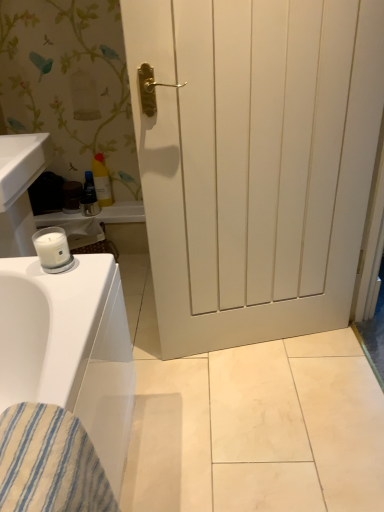
Image resolution: width=384 pixels, height=512 pixels. What do you see at coordinates (49, 463) in the screenshot? I see `blue striped fabric at lower left` at bounding box center [49, 463].

Where is `yellow plastic bottle at upper left, the first toiletry from the right`? Image resolution: width=384 pixels, height=512 pixels. yellow plastic bottle at upper left, the first toiletry from the right is located at coordinates (102, 181).

The image size is (384, 512). Identify the location of blue striped fabric at lower left. 49,463.

From a real-world perspective, is white matte door at center on top of blue striped fabric at lower left?

Correct, in the physical world, white matte door at center is higher than blue striped fabric at lower left.

Is point (345, 234) positioned in front of point (80, 498)?

No, (345, 234) is further to viewer.

Based on the photo, from the image's perspective, which is below, white matte door at center or blue striped fabric at lower left?

blue striped fabric at lower left.

Is white matte door at center situated inside blue striped fabric at lower left or outside?

white matte door at center is spatially situated outside blue striped fabric at lower left.

Consider the image. From the image's perspective, which one is positioned lower, blue glossy tube at center, the second toiletry when ordered from right to left, or white matte door at center?

white matte door at center appears lower in the image.

Can we say blue glossy tube at center, the second toiletry when ordered from right to left, lies outside white matte door at center?

blue glossy tube at center, the second toiletry when ordered from right to left, lies outside white matte door at center's area.

Based on the photo, does blue glossy tube at center, the second toiletry when ordered from right to left, appear on the left side of white matte door at center?

Indeed, blue glossy tube at center, the second toiletry when ordered from right to left, is positioned on the left side of white matte door at center.

Between blue glossy tube at center, the second toiletry when ordered from right to left, and white matte door at center, which one has smaller size?

blue glossy tube at center, the second toiletry when ordered from right to left.

Would you consider white matte door at center to be distant from yellow plastic bottle at upper left, the second toiletry in the left-to-right sequence?

Yes, white matte door at center and yellow plastic bottle at upper left, the second toiletry in the left-to-right sequence, are located far from each other.

Is yellow plastic bottle at upper left, the first toiletry from the right, a part of white matte door at center?

No, yellow plastic bottle at upper left, the first toiletry from the right, is not surrounded by white matte door at center.

Which is less distant, (324, 232) or (98, 195)?

Point (324, 232)

From the image's perspective, is white matte door at center located above yellow plastic bottle at upper left, the first toiletry from the right?

Actually, white matte door at center appears below yellow plastic bottle at upper left, the first toiletry from the right, in the image.

Which of these two, yellow plastic bottle at upper left, the first toiletry from the right, or white matte door at center, is wider?

Wider between the two is white matte door at center.

Is yellow plastic bottle at upper left, the second toiletry in the left-to-right sequence, facing away from white matte door at center?

No, yellow plastic bottle at upper left, the second toiletry in the left-to-right sequence,'s orientation is not away from white matte door at center.

From a real-world perspective, is yellow plastic bottle at upper left, the second toiletry in the left-to-right sequence, located higher than white matte door at center?

No, from a real-world perspective, yellow plastic bottle at upper left, the second toiletry in the left-to-right sequence, is not over white matte door at center

Looking at their sizes, would you say blue glossy tube at center, which is the first toiletry in left-to-right order, is wider or thinner than yellow plastic bottle at upper left, the second toiletry in the left-to-right sequence?

blue glossy tube at center, which is the first toiletry in left-to-right order, is thinner than yellow plastic bottle at upper left, the second toiletry in the left-to-right sequence.

Looking at this image, considering the relative positions of blue glossy tube at center, which is the first toiletry in left-to-right order, and yellow plastic bottle at upper left, the second toiletry in the left-to-right sequence, in the image provided, is blue glossy tube at center, which is the first toiletry in left-to-right order, behind yellow plastic bottle at upper left, the second toiletry in the left-to-right sequence,?

Yes, blue glossy tube at center, which is the first toiletry in left-to-right order, is further from the camera.

Consider the image. Between blue glossy tube at center, the second toiletry when ordered from right to left, and yellow plastic bottle at upper left, the second toiletry in the left-to-right sequence, which one has smaller size?

blue glossy tube at center, the second toiletry when ordered from right to left.

Considering the positions of objects blue glossy tube at center, which is the first toiletry in left-to-right order, and yellow plastic bottle at upper left, the second toiletry in the left-to-right sequence, in the image provided, who is more to the left, blue glossy tube at center, which is the first toiletry in left-to-right order, or yellow plastic bottle at upper left, the second toiletry in the left-to-right sequence,?

blue glossy tube at center, which is the first toiletry in left-to-right order.

From a real-world perspective, is blue striped fabric at lower left above or below white matte door at center?

From a real-world perspective, blue striped fabric at lower left is physically below white matte door at center.

Is blue striped fabric at lower left not near white matte door at center?

That's not correct — blue striped fabric at lower left is a little close to white matte door at center.

Locate an element on the screen. The image size is (384, 512). door located on the right of blue striped fabric at lower left is located at coordinates (255, 162).

Is blue striped fabric at lower left spatially inside white matte door at center, or outside of it?

blue striped fabric at lower left lies outside white matte door at center.

This screenshot has width=384, height=512. In order to click on toiletry that appears behind the yellow plastic bottle at upper left, the second toiletry in the left-to-right sequence in this screenshot , I will do `click(89, 197)`.

Is yellow plastic bottle at upper left, the first toiletry from the right, inside or outside of blue glossy tube at center, which is the first toiletry in left-to-right order?

yellow plastic bottle at upper left, the first toiletry from the right, is spatially situated outside blue glossy tube at center, which is the first toiletry in left-to-right order.

Is yellow plastic bottle at upper left, the first toiletry from the right, not near blue glossy tube at center, which is the first toiletry in left-to-right order?

No, yellow plastic bottle at upper left, the first toiletry from the right, is not far away from blue glossy tube at center, which is the first toiletry in left-to-right order.

At what (x,y) coordinates should I click in order to perform the action: click on material in front of the white matte door at center. Please return your answer as a coordinate pair (x, y). Image resolution: width=384 pixels, height=512 pixels. Looking at the image, I should click on (49, 463).

The image size is (384, 512). I want to click on door on the right of the blue glossy tube at center, which is the first toiletry in left-to-right order, so click(x=255, y=162).

Estimate the real-world distances between objects in this image. Which object is closer to white matte door at center, blue striped fabric at lower left or blue glossy tube at center, the second toiletry when ordered from right to left?

blue striped fabric at lower left is closer to white matte door at center.

When comparing their distances from blue striped fabric at lower left, does blue glossy tube at center, the second toiletry when ordered from right to left, or white matte door at center seem closer?

white matte door at center lies closer to blue striped fabric at lower left than the other object.

Considering their positions, is blue glossy tube at center, which is the first toiletry in left-to-right order, positioned closer to yellow plastic bottle at upper left, the first toiletry from the right, than white matte door at center?

The object closer to yellow plastic bottle at upper left, the first toiletry from the right, is blue glossy tube at center, which is the first toiletry in left-to-right order.

Estimate the real-world distances between objects in this image. Which object is closer to yellow plastic bottle at upper left, the first toiletry from the right, white matte door at center or blue glossy tube at center, which is the first toiletry in left-to-right order?

blue glossy tube at center, which is the first toiletry in left-to-right order, is positioned closer to the anchor yellow plastic bottle at upper left, the first toiletry from the right.

Estimate the real-world distances between objects in this image. Which object is further from white matte door at center, blue striped fabric at lower left or yellow plastic bottle at upper left, the first toiletry from the right?

Among the two, yellow plastic bottle at upper left, the first toiletry from the right, is located further to white matte door at center.

Considering their positions, is yellow plastic bottle at upper left, the second toiletry in the left-to-right sequence, positioned closer to blue glossy tube at center, the second toiletry when ordered from right to left, than white matte door at center?

yellow plastic bottle at upper left, the second toiletry in the left-to-right sequence, lies closer to blue glossy tube at center, the second toiletry when ordered from right to left, than the other object.

Considering their positions, is blue striped fabric at lower left positioned further to blue glossy tube at center, the second toiletry when ordered from right to left, than yellow plastic bottle at upper left, the first toiletry from the right?

Based on the image, blue striped fabric at lower left appears to be further to blue glossy tube at center, the second toiletry when ordered from right to left.

Estimate the real-world distances between objects in this image. Which object is closer to yellow plastic bottle at upper left, the first toiletry from the right, blue striped fabric at lower left or white matte door at center?

white matte door at center lies closer to yellow plastic bottle at upper left, the first toiletry from the right, than the other object.

Where is `toiletry located between white matte door at center and blue glossy tube at center, which is the first toiletry in left-to-right order, in the depth direction`? This screenshot has width=384, height=512. toiletry located between white matte door at center and blue glossy tube at center, which is the first toiletry in left-to-right order, in the depth direction is located at coordinates (102, 181).

Where is `toiletry positioned between blue striped fabric at lower left and blue glossy tube at center, the second toiletry when ordered from right to left, from near to far`? This screenshot has width=384, height=512. toiletry positioned between blue striped fabric at lower left and blue glossy tube at center, the second toiletry when ordered from right to left, from near to far is located at coordinates (102, 181).

This screenshot has width=384, height=512. In order to click on door located between blue striped fabric at lower left and blue glossy tube at center, the second toiletry when ordered from right to left, in the depth direction in this screenshot , I will do `click(255, 162)`.

The width and height of the screenshot is (384, 512). I want to click on door between blue striped fabric at lower left and yellow plastic bottle at upper left, the second toiletry in the left-to-right sequence, in the front-back direction, so click(x=255, y=162).